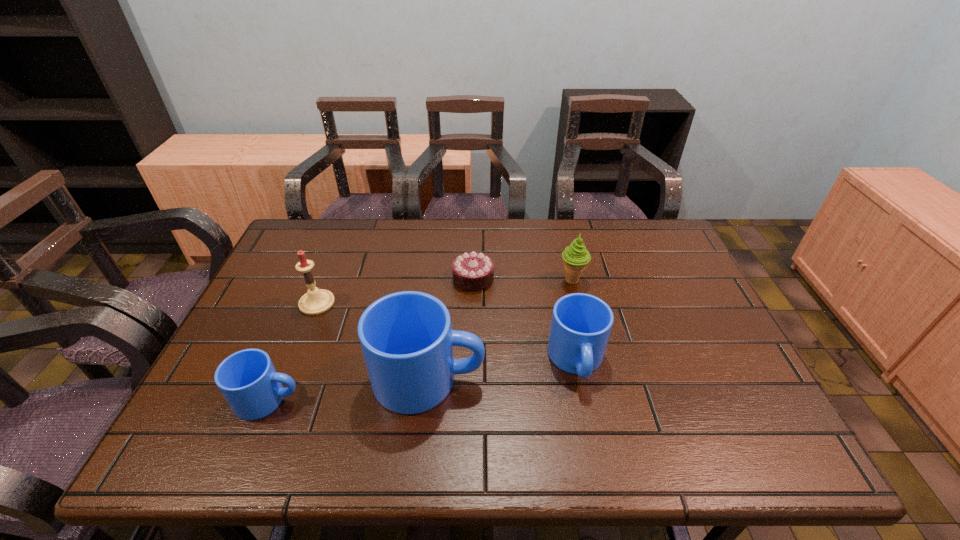
The width and height of the screenshot is (960, 540). In order to click on blank space that satisfies the following two spatial constraints: 1. on the back side of the candle; 2. on the right side of the shortest object in this screenshot , I will do `click(326, 278)`.

Find the location of a particular element. This screenshot has width=960, height=540. vacant area in the image that satisfies the following two spatial constraints: 1. on the side of the fourth tallest object with the handle; 2. on the side of the second shortest object with the handle is located at coordinates (585, 399).

Image resolution: width=960 pixels, height=540 pixels. Identify the location of vacant space that satisfies the following two spatial constraints: 1. on the side of the third shortest object with the handle; 2. on the side of the tallest mug with the handle. (581, 379).

The image size is (960, 540). Find the location of `vacant area that satisfies the following two spatial constraints: 1. on the front side of the candle; 2. on the side of the leftmost mug with the handle`. vacant area that satisfies the following two spatial constraints: 1. on the front side of the candle; 2. on the side of the leftmost mug with the handle is located at coordinates (278, 399).